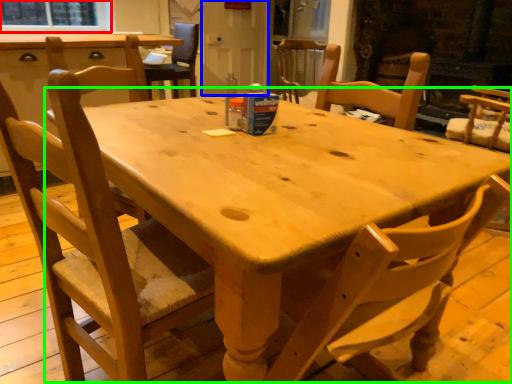
Question: Based on their relative distances, which object is nearer to window screen (highlighted by a red box)? Choose from screen door (highlighted by a blue box) and round table (highlighted by a green box).

Choices:
 (A) screen door
 (B) round table

Answer: (A)